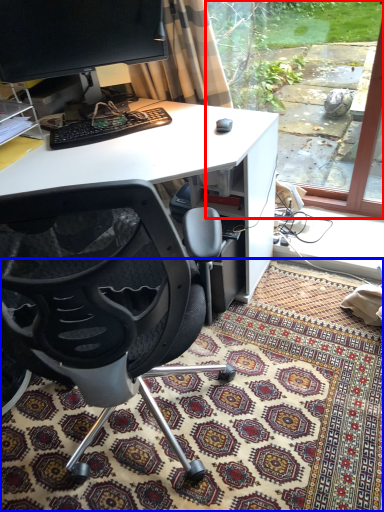
Question: Which of the following is the closest to the observer, window screen (highlighted by a red box) or mat (highlighted by a blue box)?

Choices:
 (A) window screen
 (B) mat

Answer: (B)